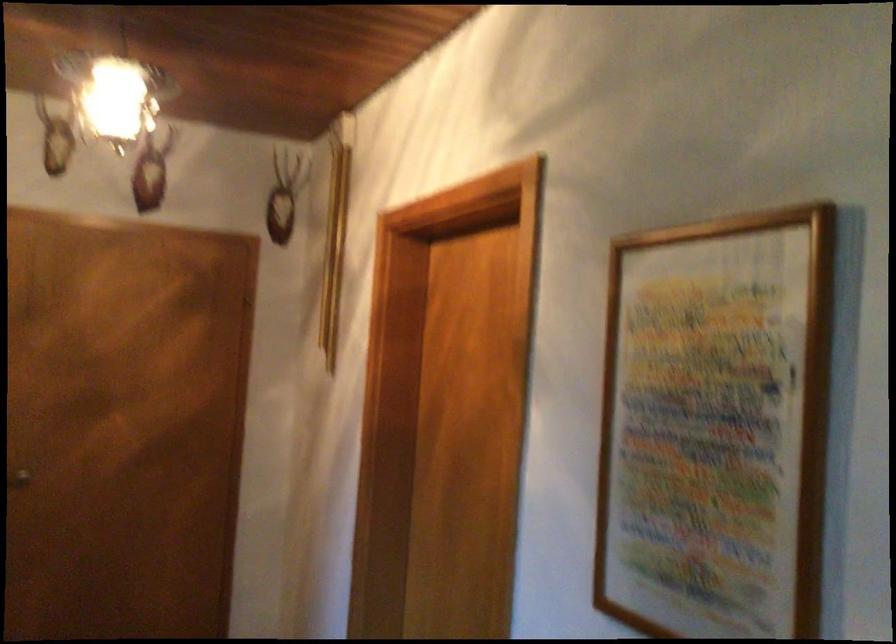
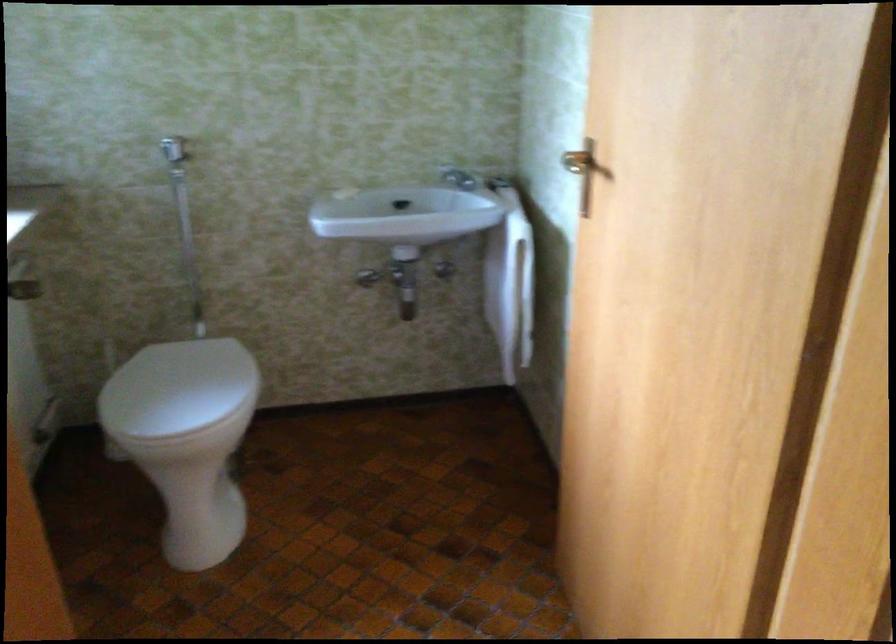
The images are taken continuously from a first-person perspective. In which direction is your viewpoint rotating?

The camera's rotation is toward left-down.